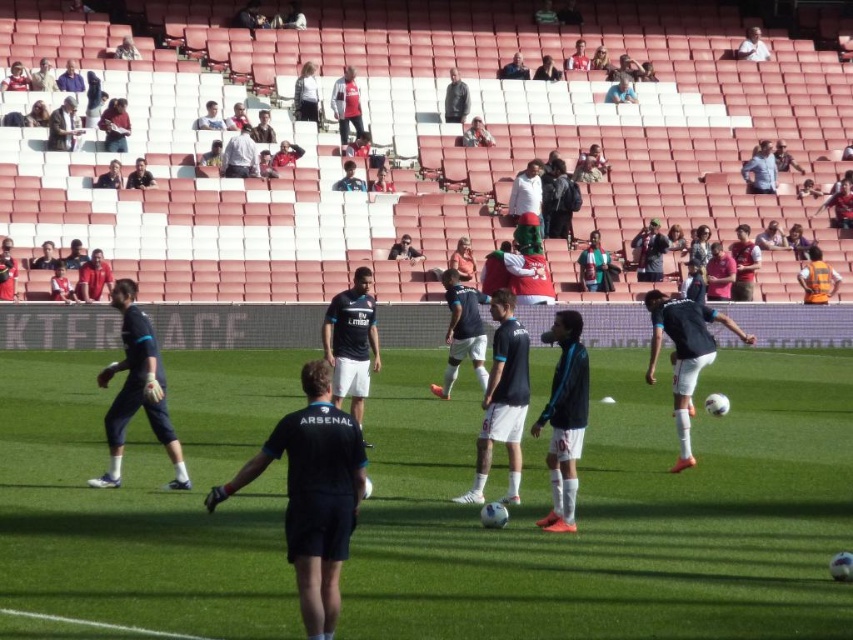
You are a photographer trying to capture a wide shot of the soccer training session. You want to ensure both the green grass football field at center and the black matte jersey at center are visible in the frame. Given their sizes, which object will appear larger in the photo?

The green grass football field at center will appear larger in the photo since it has a larger size compared to the black matte jersey at center.

You are a photographer trying to capture the soccer training session. You want to take a photo where the green grass football field at center is visible above the black matte jersey at center. Is this possible given their positions?

The green grass football field at center is located below the black matte jersey at center, so it would not be possible to capture the green grass football field at center above the black matte jersey at center in the photo.